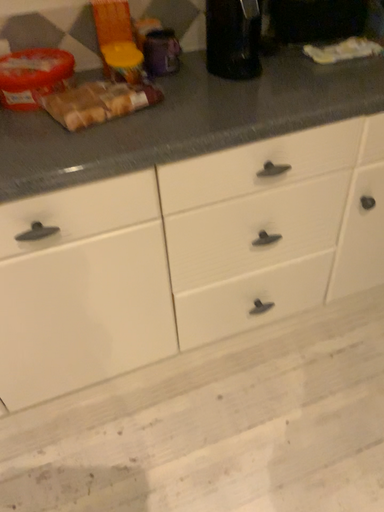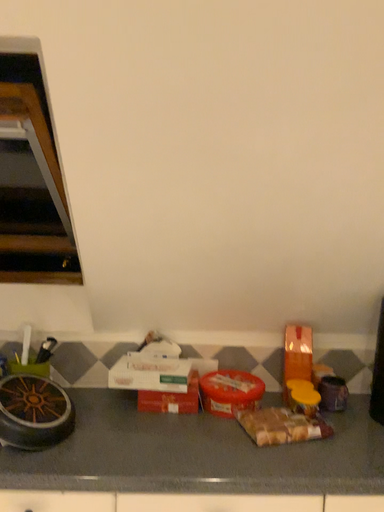
Question: How did the camera likely rotate when shooting the video?

Choices:
 (A) rotated left
 (B) rotated right

Answer: (A)